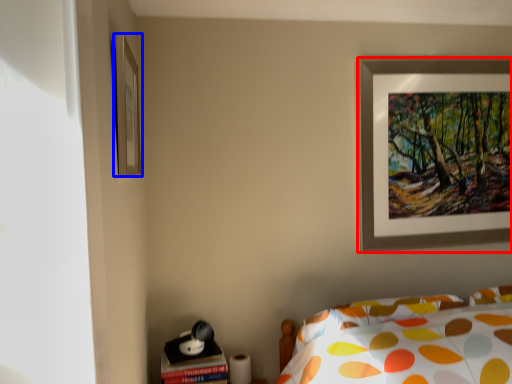
Question: Which object appears farthest to the camera in this image, picture frame (highlighted by a red box) or picture frame (highlighted by a blue box)?

Choices:
 (A) picture frame
 (B) picture frame

Answer: (A)